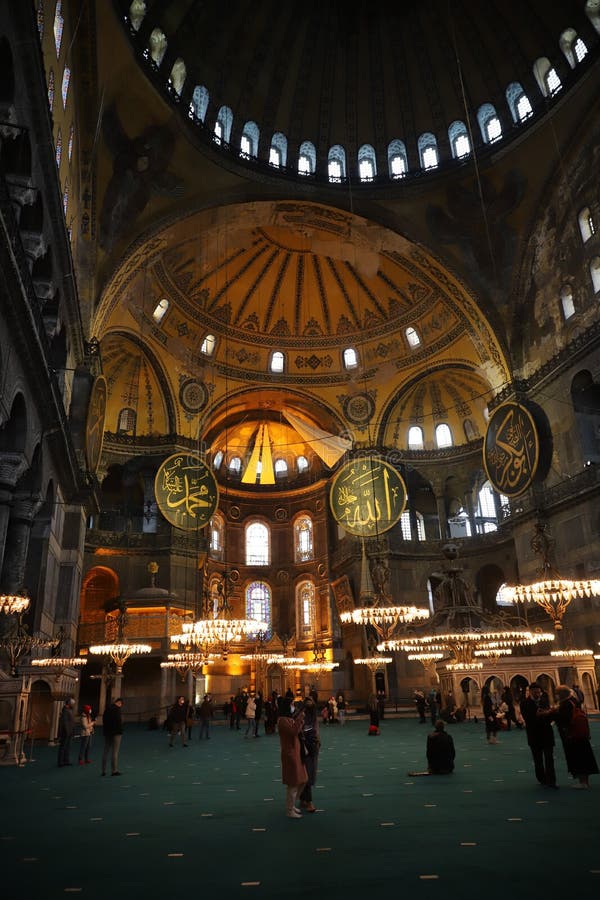
The image size is (600, 900). I want to click on floor of building with patterned rug, so click(228, 786).